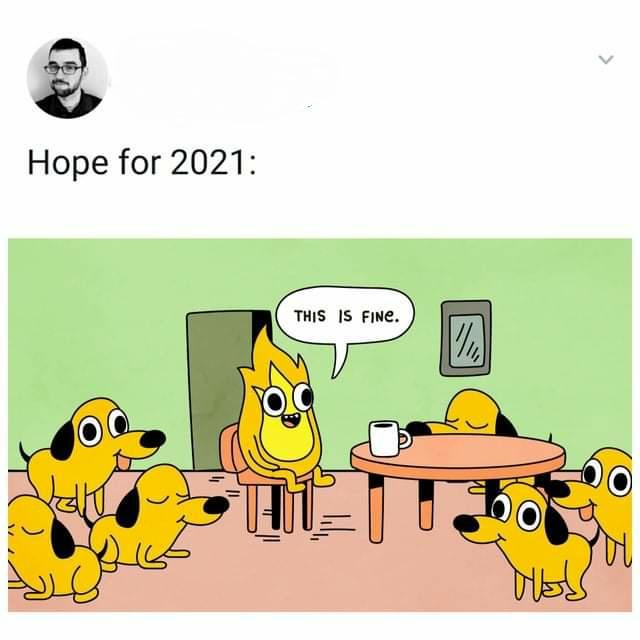
What are the coordinates of `table legs` in the screenshot? It's located at (424, 509), (381, 507), (488, 492), (546, 480).